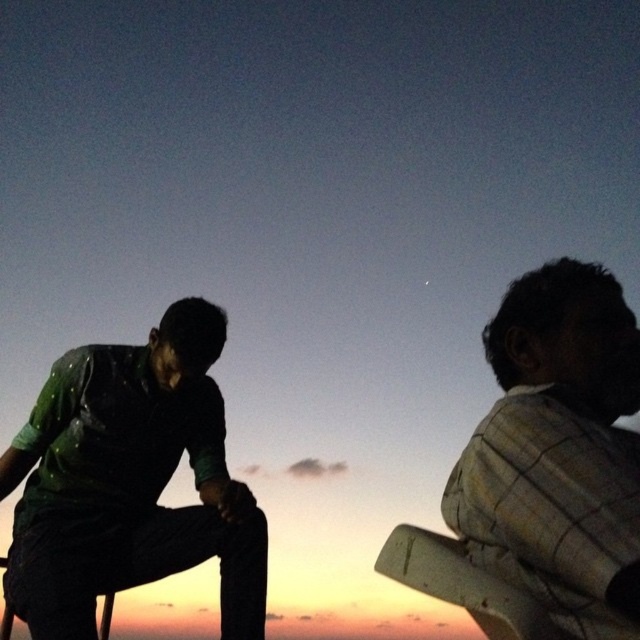
Question: Among these points, which one is farthest from the camera?

Choices:
 (A) (4, 580)
 (B) (509, 426)
 (C) (436, 557)

Answer: (A)

Question: Can you confirm if plaid fabric shirt at right is bigger than wooden chair at right?

Choices:
 (A) yes
 (B) no

Answer: (A)

Question: Is green textured pants at left to the right of wooden chair at right from the viewer's perspective?

Choices:
 (A) no
 (B) yes

Answer: (A)

Question: Which of these objects is positioned closest to the plaid fabric shirt at right?

Choices:
 (A) wooden chair at right
 (B) green textured pants at left

Answer: (A)

Question: Which point is closer to the camera?

Choices:
 (A) wooden chair at right
 (B) plaid fabric shirt at right

Answer: (B)

Question: Can you confirm if green textured pants at left is wider than wooden chair at right?

Choices:
 (A) no
 (B) yes

Answer: (B)